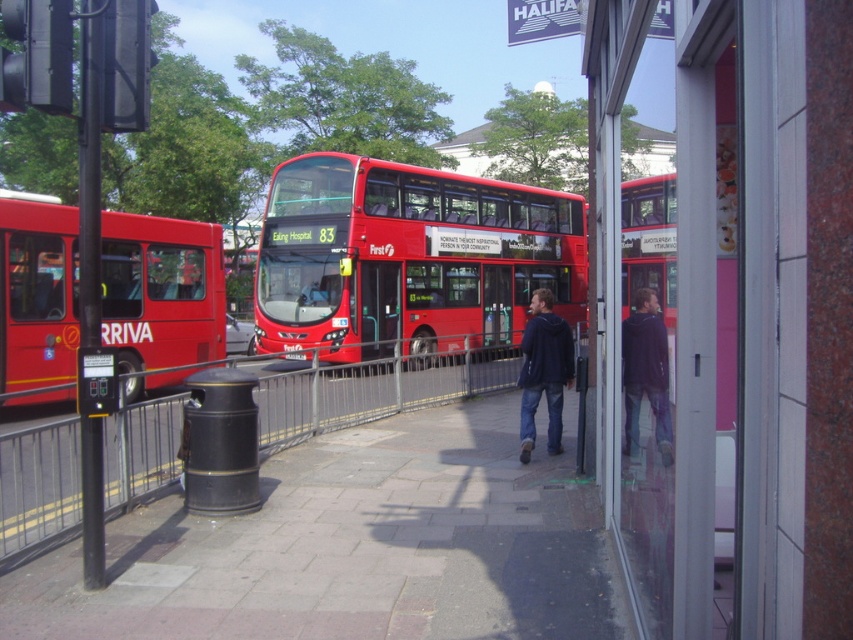
From the picture: You are standing at the center of the image. Which direction should you move to reach the matte red bus at left?

Since the matte red bus at left is located at coordinates approximately 0.455 on the x and 0.190 on the y axis, you should move to the left and slightly downward from your current position at the center to reach it.